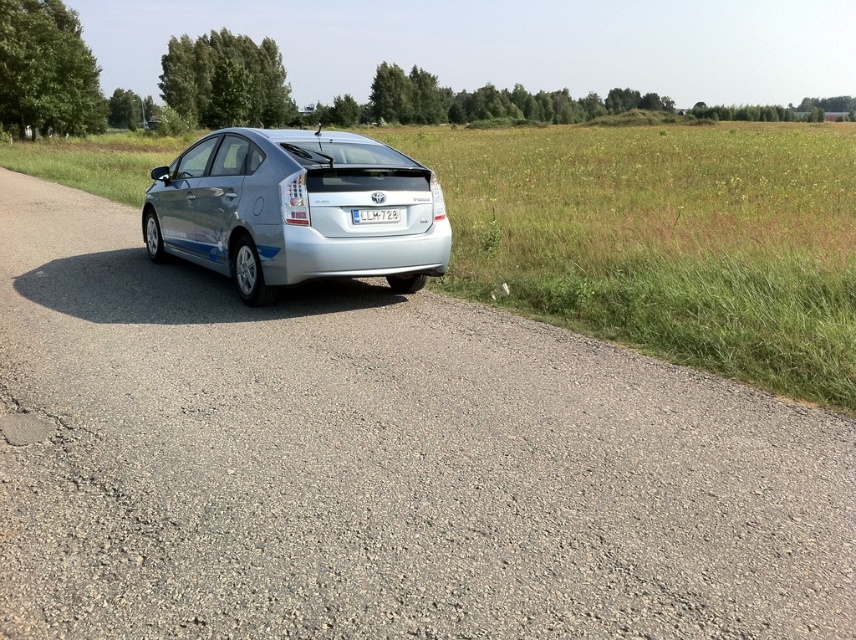
From the picture: You are a photographer trying to capture the silver metallic car at center and the white plastic license plate at center in a single shot. Considering their sizes, which object will appear bigger in the photo?

The silver metallic car at center is larger in size than the white plastic license plate at center, so it will appear bigger in the photo.

You are a delivery driver who needs to attach a magnetic GPS device to the silver metallic car at center. The device requires being placed within 30 inches of the white plastic license plate at center to function properly. Based on the scene, will the GPS device work when attached to the car?

The silver metallic car at center is 32.02 inches away from the white plastic license plate at center. Since the required distance is within 30 inches for the GPS device to function properly, the device will not work when attached to the car.

Looking at this image, you are standing at the silver Toyota Prius parked on the gravel road. You notice two points marked in the scene. Which of the two points, point [304,170] or point [387,216], is closer to you?

Point [304,170] is closer to the viewer than point [387,216].